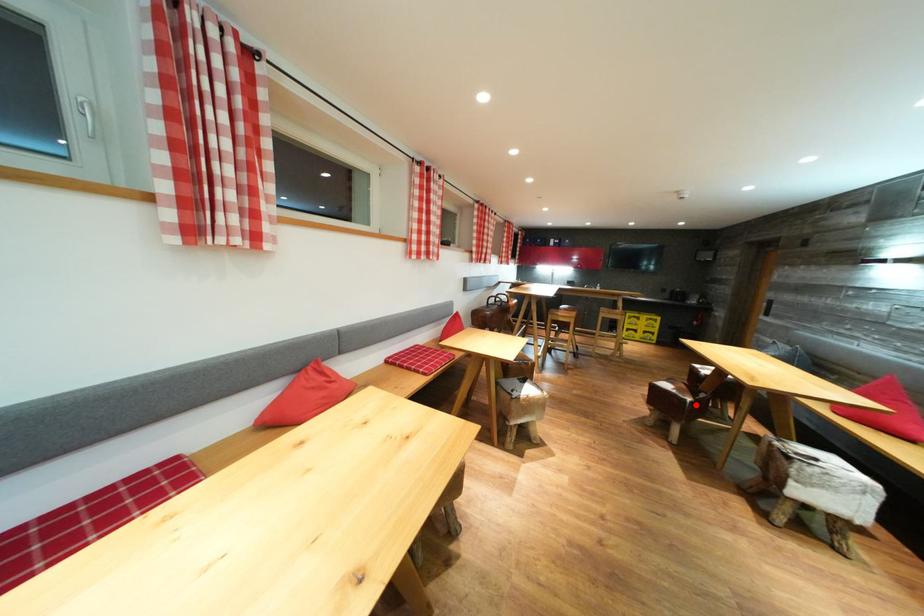
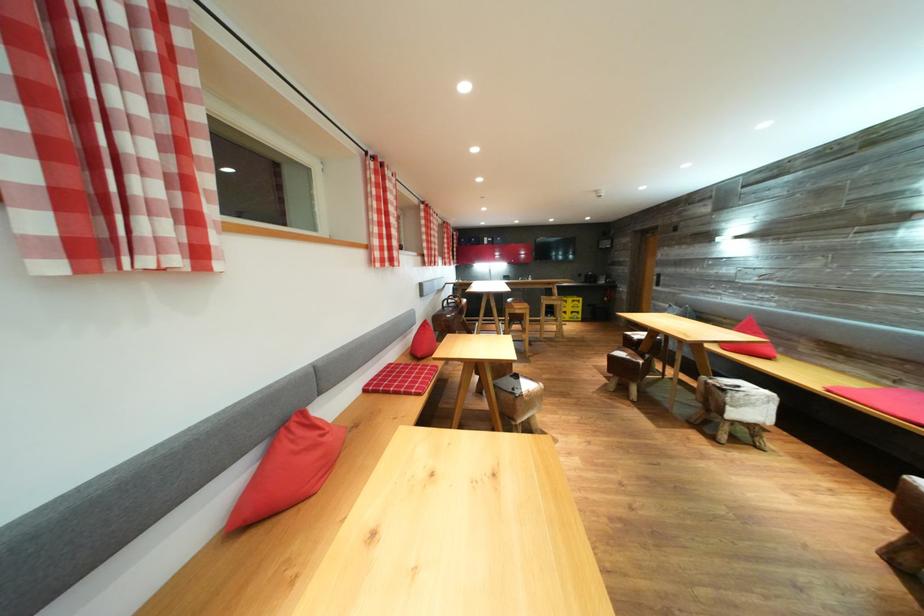
In the second image, find the point that corresponds to the highlighted location in the first image.

(648, 367)